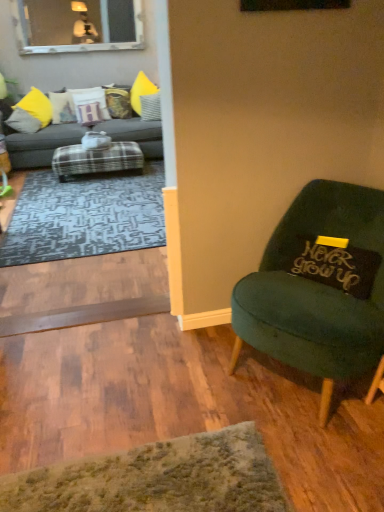
Where is `vacant space that is to the left of velvet green chair at right`? vacant space that is to the left of velvet green chair at right is located at coordinates (182, 373).